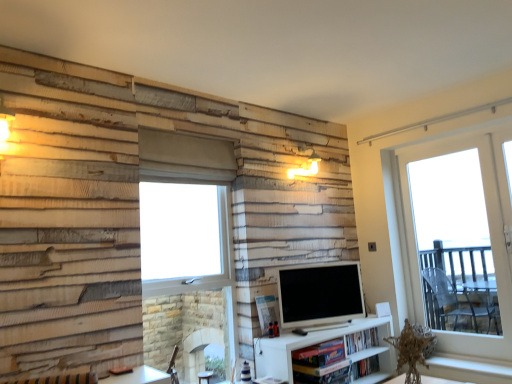
Find the location of a particular element. free spot above white wood window sill at lower right (from a real-world perspective) is located at coordinates (461, 362).